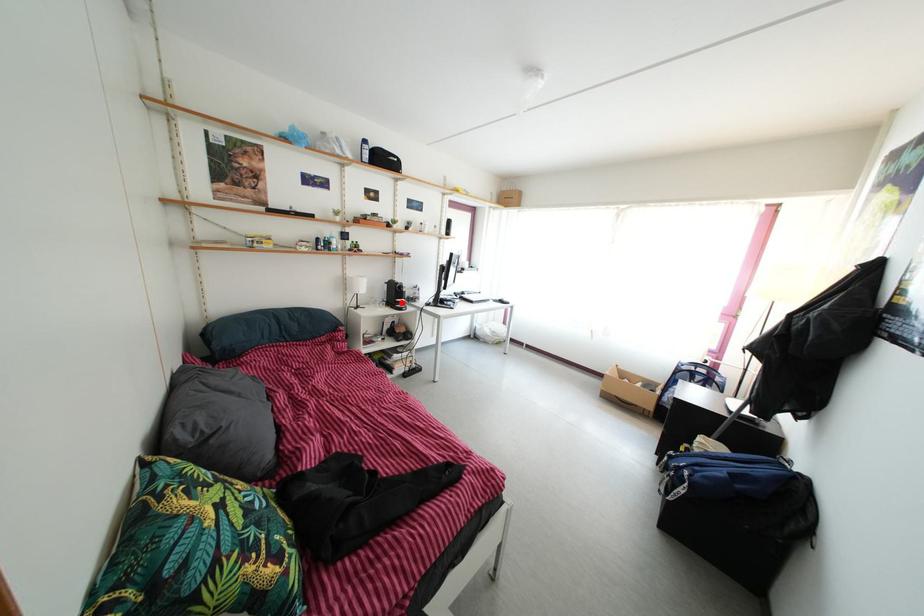
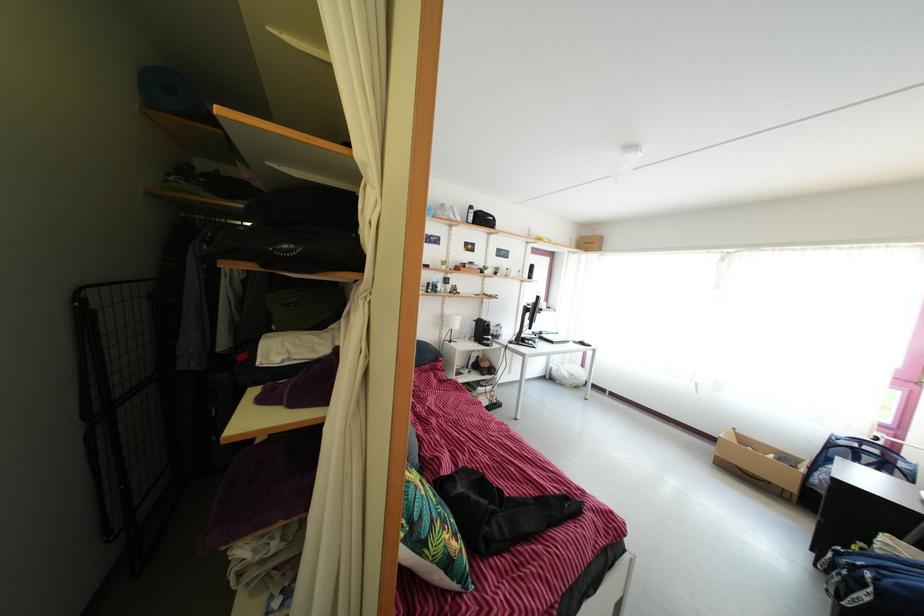
Question: I am providing you with two images of the same scene from different viewpoints. Image1 has a red point marked. In image2, the corresponding 3D location appears at what relative position? Reply with the corresponding letter.

Choices:
 (A) Closer
 (B) Farther

Answer: (B)